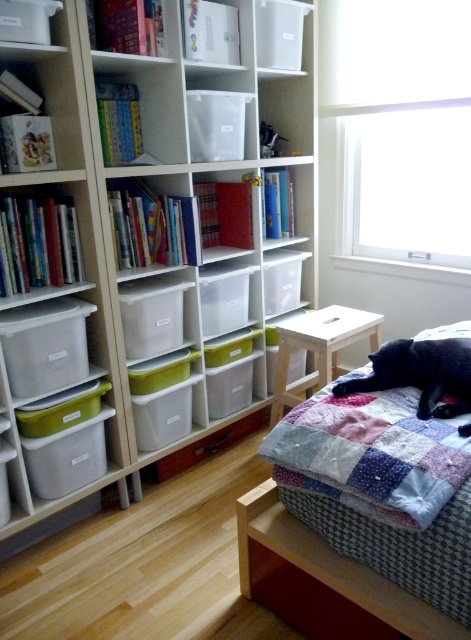
The patchwork quilt at center is located at what coordinates?

The patchwork quilt at center is located at coordinates point (360, 518).

You are sitting on the light wood stool at center and want to reach a book from the white plastic bookcase at upper left. Can you easily reach it without standing up?

The white plastic bookcase at upper left is above the light wood stool at center, so you can easily reach it while sitting since it is positioned within arm

You are standing in the room and want to move from point A to point B. Point A is at coordinates point (279,554) and point B is at coordinates point (374,326). Which point is closer to you when you are facing the shelving unit?

Point (279,554) is in front of point (374,326), so when facing the shelving unit, point A is closer to you than point B.